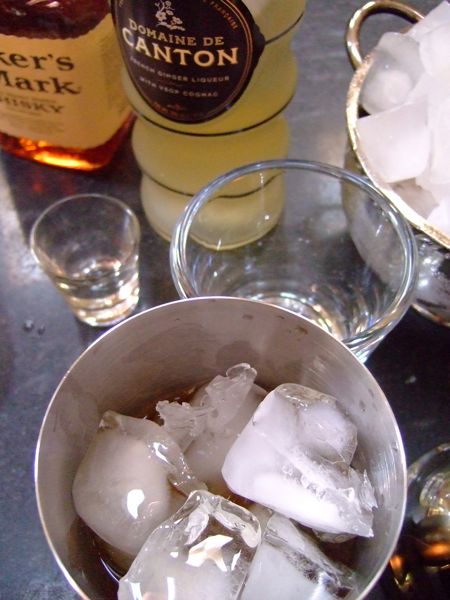
Where is `table`? This screenshot has height=600, width=450. table is located at coordinates (46, 361), (122, 177), (310, 145), (414, 363), (379, 591).